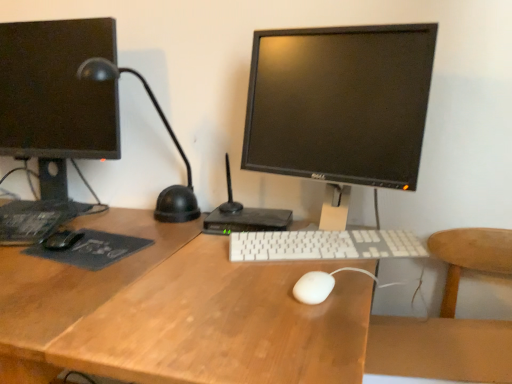
Question: Is black matte mouse at left, the 2th mouse positioned from the bottom, smaller than dark gray matte mousepad at left?

Choices:
 (A) yes
 (B) no

Answer: (A)

Question: Does black matte mouse at left, marked as the first mouse in a back-to-front arrangement, have a greater width compared to dark gray matte mousepad at left?

Choices:
 (A) no
 (B) yes

Answer: (A)

Question: From a real-world perspective, is black matte mouse at left, which is the 1th mouse in left-to-right order, positioned over dark gray matte mousepad at left based on gravity?

Choices:
 (A) yes
 (B) no

Answer: (A)

Question: Is black matte mouse at left, the 2th mouse positioned from the bottom, at the right side of dark gray matte mousepad at left?

Choices:
 (A) no
 (B) yes

Answer: (A)

Question: Is the surface of black matte mouse at left, which ranks as the second mouse in front-to-back order, in direct contact with dark gray matte mousepad at left?

Choices:
 (A) no
 (B) yes

Answer: (B)

Question: Is white matte mouse at center, arranged as the second mouse when viewed from the top, taller or shorter than black glossy monitor at center, which is counted as the first computer monitor, starting from the right?

Choices:
 (A) short
 (B) tall

Answer: (A)

Question: From the image's perspective, is white matte mouse at center, the second mouse from the back, located above or below black glossy monitor at center, arranged as the 2th computer monitor when viewed from the left?

Choices:
 (A) above
 (B) below

Answer: (B)

Question: From a real-world perspective, is white matte mouse at center, placed as the first mouse when sorted from right to left, positioned above or below black glossy monitor at center, which is counted as the first computer monitor, starting from the right?

Choices:
 (A) above
 (B) below

Answer: (B)

Question: Considering the positions of white matte mouse at center, which ranks as the 1th mouse in bottom-to-top order, and black glossy monitor at center, arranged as the 2th computer monitor when viewed from the left, in the image, is white matte mouse at center, which ranks as the 1th mouse in bottom-to-top order, bigger or smaller than black glossy monitor at center, arranged as the 2th computer monitor when viewed from the left,?

Choices:
 (A) big
 (B) small

Answer: (B)

Question: In terms of width, does wooden at right look wider or thinner when compared to dark gray matte mousepad at left?

Choices:
 (A) wide
 (B) thin

Answer: (A)

Question: From the image's perspective, is wooden at right above or below dark gray matte mousepad at left?

Choices:
 (A) above
 (B) below

Answer: (B)

Question: Considering the positions of wooden at right and dark gray matte mousepad at left in the image, is wooden at right taller or shorter than dark gray matte mousepad at left?

Choices:
 (A) tall
 (B) short

Answer: (A)

Question: Looking at the image, does wooden at right seem bigger or smaller compared to dark gray matte mousepad at left?

Choices:
 (A) big
 (B) small

Answer: (A)

Question: In terms of width, does white matte mouse at center, placed as the first mouse when sorted from right to left, look wider or thinner when compared to white plastic keyboard at center?

Choices:
 (A) wide
 (B) thin

Answer: (B)

Question: Is point (309, 284) positioned closer to the camera than point (416, 241)?

Choices:
 (A) closer
 (B) farther

Answer: (A)